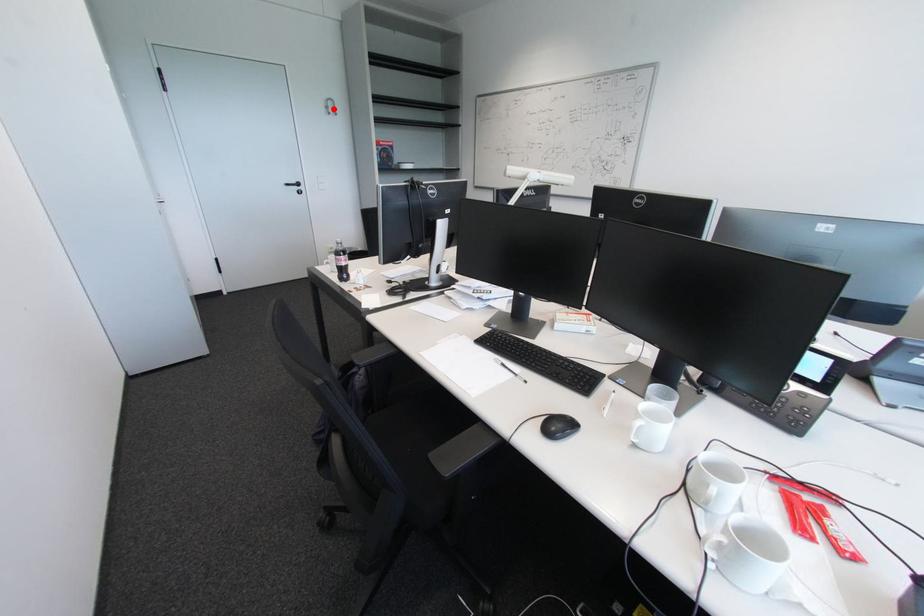
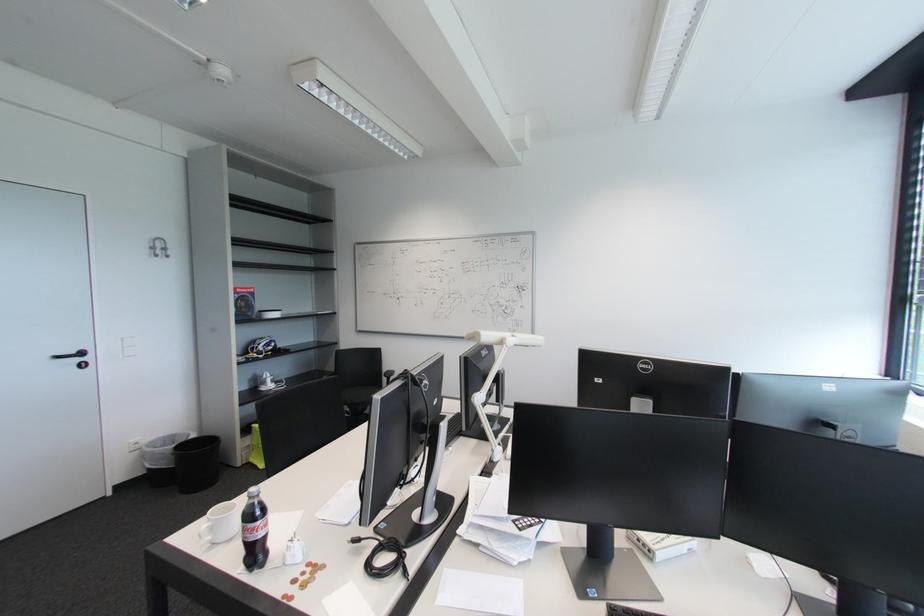
Question: I am providing you with two images of the same scene from different viewpoints. Image1 has a red point marked. In image2, the corresponding 3D location appears at what relative position? Reply with the corresponding letter.

Choices:
 (A) Closer
 (B) Farther

Answer: (B)